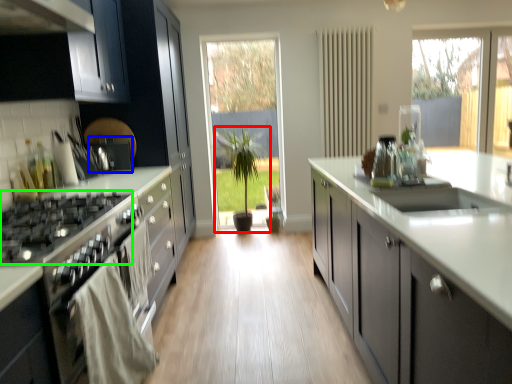
Question: Considering the real-world distances, which object is closest to houseplant (highlighted by a red box)? appliance (highlighted by a blue box) or gas stove (highlighted by a green box).

Choices:
 (A) appliance
 (B) gas stove

Answer: (A)